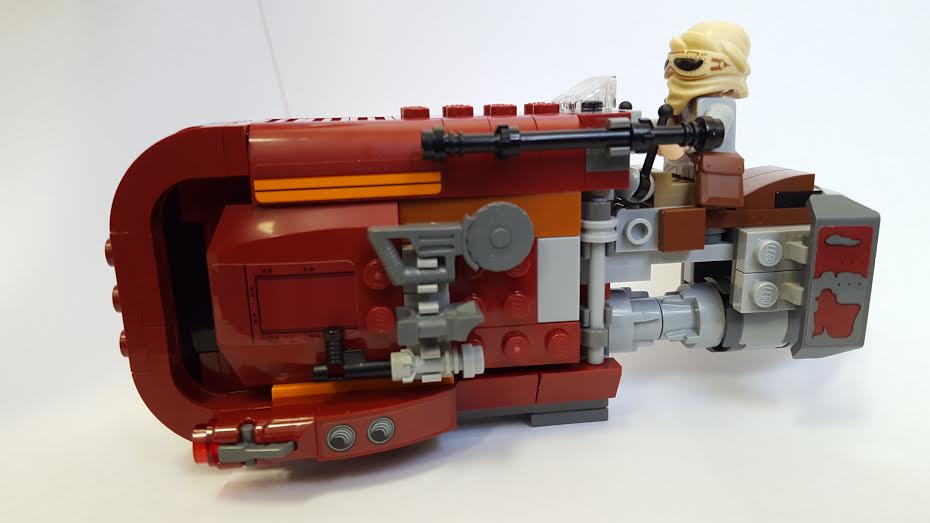
Locate an element on the screen. The width and height of the screenshot is (930, 523). floor is located at coordinates (662, 442).